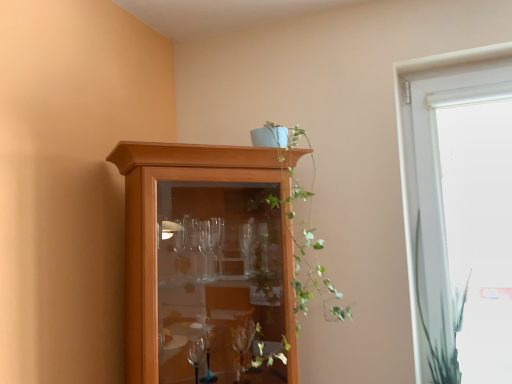
Question: Considering the relative sizes of green leafy plant at upper center and white glass window at right in the image provided, is green leafy plant at upper center taller than white glass window at right?

Choices:
 (A) no
 (B) yes

Answer: (A)

Question: From the image's perspective, is green leafy plant at upper center below white glass window at right?

Choices:
 (A) no
 (B) yes

Answer: (A)

Question: From a real-world perspective, is green leafy plant at upper center on white glass window at right?

Choices:
 (A) yes
 (B) no

Answer: (A)

Question: Is green leafy plant at upper center positioned in front of white glass window at right?

Choices:
 (A) no
 (B) yes

Answer: (B)

Question: Is green leafy plant at upper center to the left of white glass window at right from the viewer's perspective?

Choices:
 (A) yes
 (B) no

Answer: (A)

Question: Is green leafy plant at right wider or thinner than green leafy plant at upper center?

Choices:
 (A) wide
 (B) thin

Answer: (B)

Question: Considering their positions, is green leafy plant at right located in front of or behind green leafy plant at upper center?

Choices:
 (A) front
 (B) behind

Answer: (B)

Question: Is green leafy plant at right spatially inside green leafy plant at upper center, or outside of it?

Choices:
 (A) inside
 (B) outside

Answer: (B)

Question: Is point (429, 360) closer or farther from the camera than point (313, 284)?

Choices:
 (A) closer
 (B) farther

Answer: (B)

Question: From the image's perspective, is green leafy plant at right positioned above or below wooden cabinet at upper center?

Choices:
 (A) below
 (B) above

Answer: (A)

Question: Considering the positions of green leafy plant at right and wooden cabinet at upper center in the image, is green leafy plant at right bigger or smaller than wooden cabinet at upper center?

Choices:
 (A) big
 (B) small

Answer: (B)

Question: Is green leafy plant at right taller or shorter than wooden cabinet at upper center?

Choices:
 (A) tall
 (B) short

Answer: (B)

Question: Considering the positions of green leafy plant at right and wooden cabinet at upper center in the image, is green leafy plant at right wider or thinner than wooden cabinet at upper center?

Choices:
 (A) wide
 (B) thin

Answer: (B)

Question: Based on their positions, is wooden cabinet at upper center located to the left or right of green leafy plant at upper center?

Choices:
 (A) left
 (B) right

Answer: (A)

Question: Is wooden cabinet at upper center in front of or behind green leafy plant at upper center in the image?

Choices:
 (A) behind
 (B) front

Answer: (B)